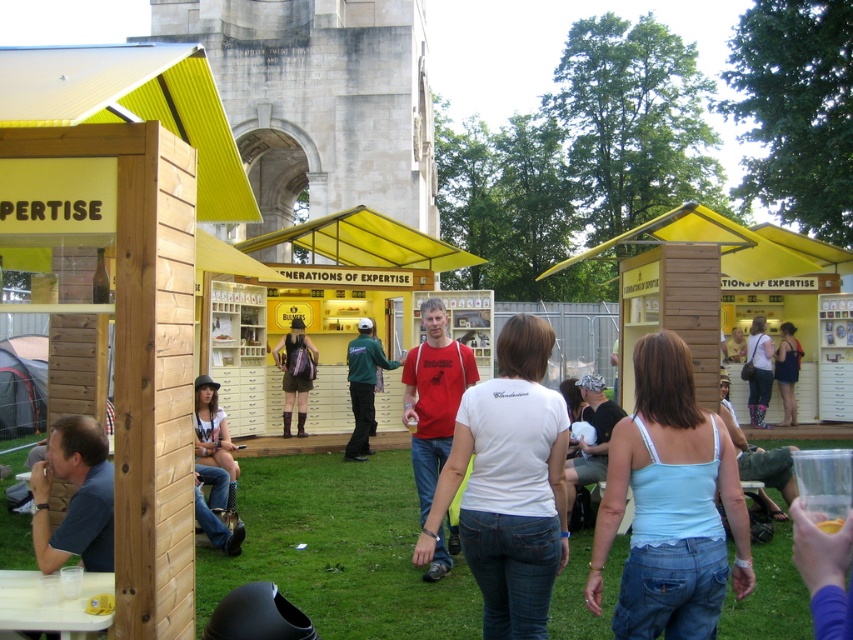
Question: Does black fabric headscarf at center have a larger size compared to matte white shirt at center?

Choices:
 (A) yes
 (B) no

Answer: (A)

Question: Which of the following is the farthest from the observer?

Choices:
 (A) (782, 332)
 (B) (607, 451)

Answer: (A)

Question: Does light blue cotton tank top at center come in front of denim shorts at lower left?

Choices:
 (A) no
 (B) yes

Answer: (B)

Question: Is denim shorts at lower left positioned at the back of matte white shirt at center?

Choices:
 (A) yes
 (B) no

Answer: (B)

Question: Estimate the real-world distances between objects in this image. Which object is closer to the matte white shirt at center?

Choices:
 (A) blue shirt at lower left
 (B) black fabric headscarf at center
 (C) clear plastic cups at lower left
 (D) denim shorts at lower left

Answer: (B)

Question: Which point is closer to the camera?

Choices:
 (A) (596, 388)
 (B) (422, 504)
 (C) (361, 380)
 (D) (491, 477)

Answer: (D)